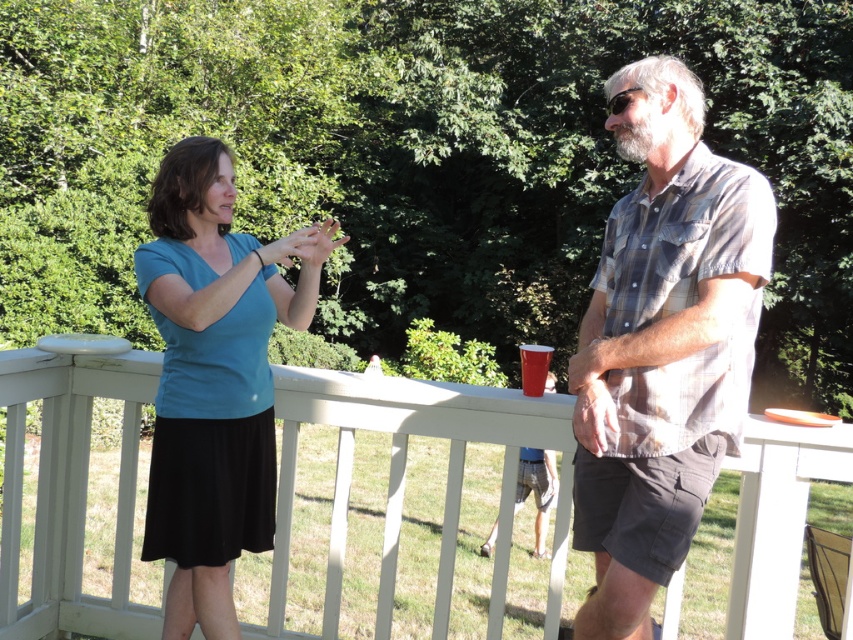
You are a photographer trying to capture a candid shot of the matte blue shirt at center and the red plastic cup at center. Since you want to focus on the shirt, which object should you adjust your camera to prioritize in the frame?

The matte blue shirt at center is positioned over the red plastic cup at center, so adjusting the camera focus on the matte blue shirt at center would naturally prioritize it in the frame.

From the picture: You are a photographer setting up a shot of the blue cotton shirt at upper center and the red plastic cup at center. Since you want to focus on the shirt, which object should you position closer to the camera to ensure it appears larger in the photo?

To make the blue cotton shirt at upper center appear larger in the photo, you should position it closer to the camera than the red plastic cup at center. Since the blue cotton shirt at upper center naturally occupies less space than the red plastic cup at center, moving it closer will help it dominate the frame.

You are a photographer trying to capture a candid shot of the blue cotton shirt at upper center and the white wooden railing at upper center. Since the railing is positioned under the shirt, would you adjust your camera angle to look upwards or downwards to frame both subjects properly?

Since the white wooden railing at upper center is positioned under the blue cotton shirt at upper center, you should adjust your camera angle to look upwards to frame both subjects properly.